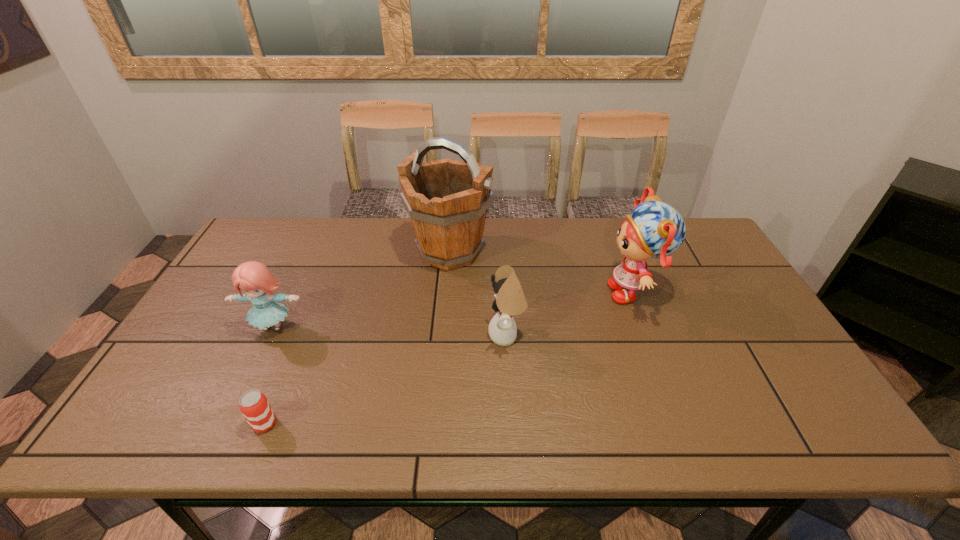
This screenshot has height=540, width=960. In the image, there is a desktop. What are the coordinates of `free space at the near edge` in the screenshot? It's located at (617, 415).

I want to click on free space at the left edge, so click(x=177, y=382).

Identify the location of vacant space at the right edge of the desktop. This screenshot has height=540, width=960. (732, 307).

The width and height of the screenshot is (960, 540). I want to click on free point at the far left corner, so click(x=289, y=234).

In the image, there is a desktop. Identify the location of free space at the near right corner. (818, 410).

I want to click on vacant region between the second doll from right to left and the beer can, so click(386, 380).

Where is `blank region between the second doll from right to left and the leftmost doll`? This screenshot has width=960, height=540. blank region between the second doll from right to left and the leftmost doll is located at coordinates (390, 331).

Identify the location of free space between the second doll from right to left and the beer can. (386, 380).

What are the coordinates of `vacant space in between the tallest object and the second doll from left to right` in the screenshot? It's located at (478, 293).

At what (x,y) coordinates should I click in order to perform the action: click on unoccupied area between the tallest object and the tallest doll. Please return your answer as a coordinate pair (x, y). The image size is (960, 540). Looking at the image, I should click on (541, 272).